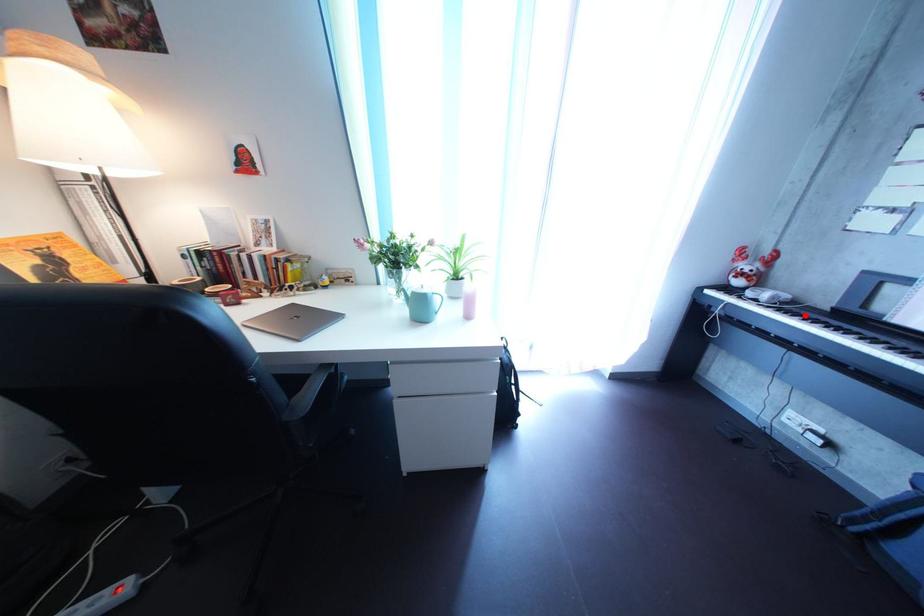
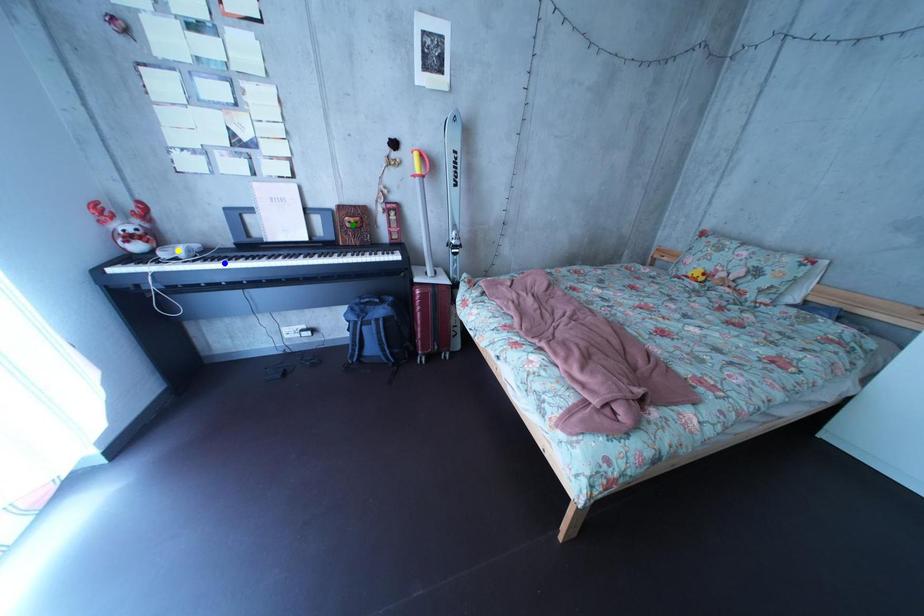
Question: I am providing you with two images of the same scene from different viewpoints. A red point is marked on the first image. You are given multiple points on the second image. Which spot in image 2 lines up with the point in image 1?

Choices:
 (A) green point
 (B) yellow point
 (C) blue point

Answer: (C)